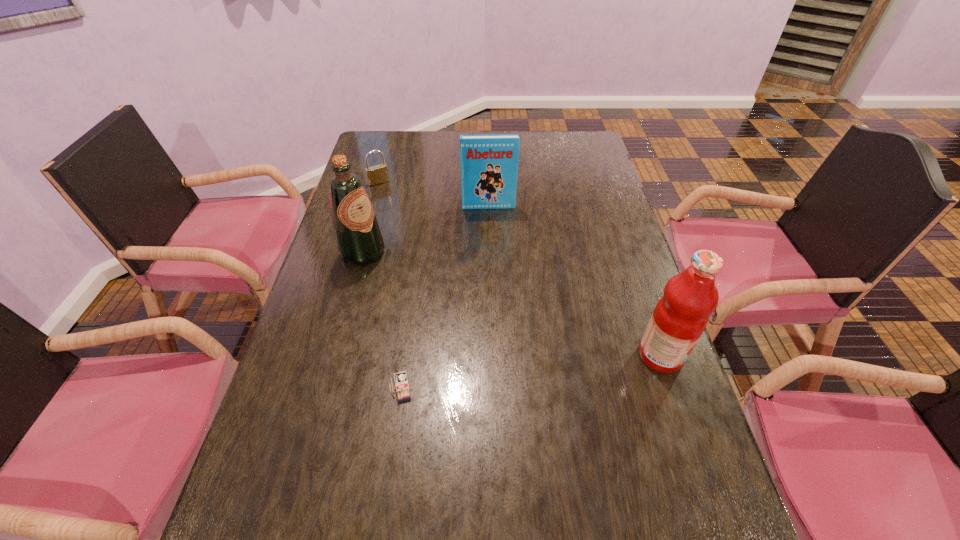
Find the location of a particular element. This screenshot has height=540, width=960. the third object from right to left is located at coordinates (399, 377).

Where is `fruit juice`? fruit juice is located at coordinates (681, 315).

Find the location of a particular element. The image size is (960, 540). the farthest object is located at coordinates (378, 174).

Find the location of `the third farthest object`. the third farthest object is located at coordinates pyautogui.click(x=359, y=241).

I want to click on book, so click(x=489, y=163).

The image size is (960, 540). I want to click on the second object from right to left, so click(x=489, y=163).

Find the location of a particular element. Image resolution: width=960 pixels, height=540 pixels. vacant space situated 0.230m on the left of the third object from right to left is located at coordinates (286, 387).

Where is `blank area located 0.350m on the front-facing side of the padlock`? Image resolution: width=960 pixels, height=540 pixels. blank area located 0.350m on the front-facing side of the padlock is located at coordinates (420, 246).

The height and width of the screenshot is (540, 960). In order to click on blank space located on the front-facing side of the padlock in this screenshot , I will do `click(421, 248)`.

Locate an element on the screen. This screenshot has height=540, width=960. vacant space located 0.250m on the front-facing side of the padlock is located at coordinates 408,227.